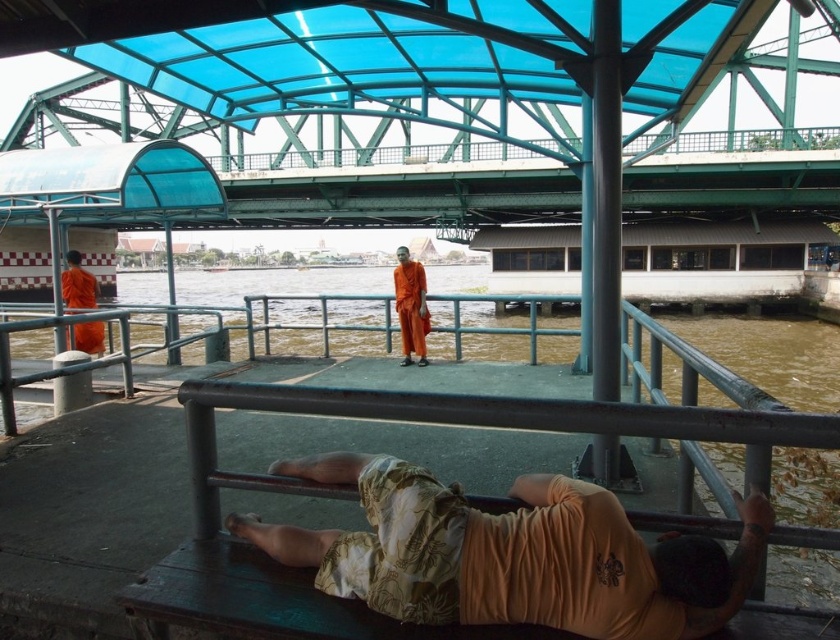
You are a photographer standing at the ferry terminal. You notice two items in the scene, the hawaiian print fabric shirt at lower center and the orange cloth at center. Which one is shorter in height?

The hawaiian print fabric shirt at lower center has a lesser height compared to orange cloth at center, so the hawaiian print fabric shirt at lower center is shorter in height.

You are a photographer standing on the deck of the ferry terminal. You see an orange cloth at center and an orange cloth monk at left. Which object is wider?

The orange cloth monk at left is wider than the orange cloth at center.

You are a photographer standing at the ferry terminal. You want to take a photo of the hawaiian print fabric shirt at lower center and the orange cloth monk at left. Which of the two subjects is closer to the camera?

The hawaiian print fabric shirt at lower center is closer to the camera because it is shorter than the orange cloth monk at left.